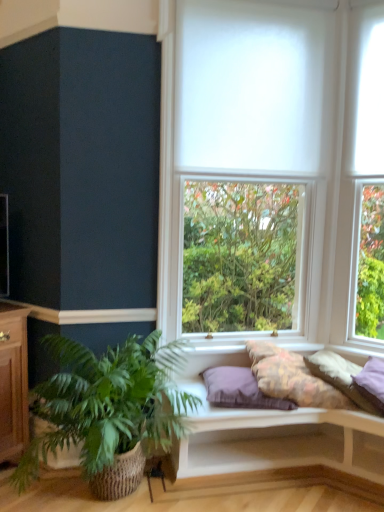
The image size is (384, 512). What do you see at coordinates (249, 87) in the screenshot? I see `white matte blind at upper center` at bounding box center [249, 87].

What do you see at coordinates (292, 378) in the screenshot? The height and width of the screenshot is (512, 384). I see `fluffy cotton pillow at center, the second pillow in the left-to-right sequence` at bounding box center [292, 378].

Based on the photo, measure the distance between point (207, 409) and camera.

Point (207, 409) is 7.18 feet from camera.

The image size is (384, 512). Find the location of `purple fabric pillow at center, which is the 1th pillow from left to right`. purple fabric pillow at center, which is the 1th pillow from left to right is located at coordinates (239, 390).

Measure the distance between point (x=35, y=391) and camera.

The distance of point (x=35, y=391) from camera is 2.07 meters.

This screenshot has height=512, width=384. In order to click on fluffy white pillow at right, which is the third pillow in left-to-right order in this screenshot , I will do `click(340, 377)`.

Does fluffy white pillow at right, marked as the 1th pillow in a right-to-left arrangement, have a greater height compared to white matte blind at upper center?

No, fluffy white pillow at right, marked as the 1th pillow in a right-to-left arrangement, is not taller than white matte blind at upper center.

Is fluffy white pillow at right, which is the third pillow in left-to-right order, located outside white matte blind at upper center?

Absolutely, fluffy white pillow at right, which is the third pillow in left-to-right order, is external to white matte blind at upper center.

Is fluffy white pillow at right, marked as the 1th pillow in a right-to-left arrangement, oriented towards white matte blind at upper center?

No.

Is purple fabric pillow at center, which is the 1th pillow from left to right, next to white matte window at center?

No, purple fabric pillow at center, which is the 1th pillow from left to right, is not touching white matte window at center.

From a real-world perspective, which is physically below, purple fabric pillow at center, which ranks as the 3th pillow in right-to-left order, or white matte window at center?

purple fabric pillow at center, which ranks as the 3th pillow in right-to-left order, is physically lower.

From the image's perspective, which one is positioned lower, purple fabric pillow at center, which is the 1th pillow from left to right, or white matte window at center?

purple fabric pillow at center, which is the 1th pillow from left to right, is shown below in the image.

Looking at this image, which is farther from the camera, (225, 404) or (332, 76)?

The point (332, 76) is behind.

Is green woven basket at lower left completely or partially inside fluffy white pillow at right, which is the third pillow in left-to-right order?

No, fluffy white pillow at right, which is the third pillow in left-to-right order, does not contain green woven basket at lower left.

Considering the relative sizes of fluffy white pillow at right, marked as the 1th pillow in a right-to-left arrangement, and green woven basket at lower left in the image provided, is fluffy white pillow at right, marked as the 1th pillow in a right-to-left arrangement, taller than green woven basket at lower left?

Incorrect, the height of fluffy white pillow at right, marked as the 1th pillow in a right-to-left arrangement, is not larger of that of green woven basket at lower left.

Considering the sizes of objects fluffy white pillow at right, marked as the 1th pillow in a right-to-left arrangement, and green woven basket at lower left in the image provided, who is bigger, fluffy white pillow at right, marked as the 1th pillow in a right-to-left arrangement, or green woven basket at lower left?

With larger size is green woven basket at lower left.

How different are the orientations of fluffy white pillow at right, marked as the 1th pillow in a right-to-left arrangement, and green woven basket at lower left in degrees?

The angular difference between fluffy white pillow at right, marked as the 1th pillow in a right-to-left arrangement, and green woven basket at lower left is 42.2 degrees.

Who is bigger, fluffy cotton pillow at center, which is the 2th pillow in right-to-left order, or white matte blind at upper center?

With larger size is fluffy cotton pillow at center, which is the 2th pillow in right-to-left order.

From the picture: Considering the positions of objects fluffy cotton pillow at center, the second pillow in the left-to-right sequence, and white matte blind at upper center in the image provided, who is more to the left, fluffy cotton pillow at center, the second pillow in the left-to-right sequence, or white matte blind at upper center?

Positioned to the left is white matte blind at upper center.

Does fluffy cotton pillow at center, the second pillow in the left-to-right sequence, touch white matte blind at upper center?

No, fluffy cotton pillow at center, the second pillow in the left-to-right sequence, is not touching white matte blind at upper center.

Is the depth of fluffy cotton pillow at center, the second pillow in the left-to-right sequence, greater than that of white matte blind at upper center?

No.

Is white matte window at center positioned beyond the bounds of green woven basket at lower left?

Yes, white matte window at center is outside of green woven basket at lower left.

The height and width of the screenshot is (512, 384). What are the coordinates of `houseplant in front of the white matte window at center` in the screenshot? It's located at (107, 411).

Does white matte window at center come in front of green woven basket at lower left?

No, white matte window at center is further to the viewer.

From a real-world perspective, between fluffy cotton pillow at center, the second pillow in the left-to-right sequence, and white matte window at center, who is vertically lower?

fluffy cotton pillow at center, the second pillow in the left-to-right sequence, is physically lower.

Based on the photo, which of these two, fluffy cotton pillow at center, the second pillow in the left-to-right sequence, or white matte window at center, is wider?

fluffy cotton pillow at center, the second pillow in the left-to-right sequence.

Does point (336, 397) lie in front of point (163, 52)?

Yes.

From the image's perspective, which is above, fluffy cotton pillow at center, the second pillow in the left-to-right sequence, or white matte window at center?

white matte window at center is shown above in the image.

Which object is further away from the camera taking this photo, white matte blind at upper center or green woven basket at lower left?

white matte blind at upper center is further from the camera.

Is white matte blind at upper center taller than green woven basket at lower left?

Indeed, white matte blind at upper center has a greater height compared to green woven basket at lower left.

Which point is more forward, (261, 99) or (131, 439)?

The point (131, 439) is more forward.

Is white matte blind at upper center looking in the opposite direction of green woven basket at lower left?

No, white matte blind at upper center's orientation is not away from green woven basket at lower left.

The width and height of the screenshot is (384, 512). What are the coordinates of `blind behind the fluffy white pillow at right, marked as the 1th pillow in a right-to-left arrangement` in the screenshot? It's located at (249, 87).

This screenshot has width=384, height=512. In order to click on pillow that is the 1st one when counting forward from the white matte window at center in this screenshot , I will do `click(239, 390)`.

From the image, which object appears to be nearer to white matte window at center, fluffy cotton pillow at center, the second pillow in the left-to-right sequence, or fluffy white pillow at right, marked as the 1th pillow in a right-to-left arrangement?

The object closer to white matte window at center is fluffy cotton pillow at center, the second pillow in the left-to-right sequence.

Estimate the real-world distances between objects in this image. Which object is further from white cushioned bench at lower center, purple fabric pillow at center, which ranks as the 3th pillow in right-to-left order, or fluffy cotton pillow at center, which is the 2th pillow in right-to-left order?

fluffy cotton pillow at center, which is the 2th pillow in right-to-left order, is further to white cushioned bench at lower center.

Considering their positions, is white matte window at center positioned closer to white cushioned bench at lower center than fluffy white pillow at right, marked as the 1th pillow in a right-to-left arrangement?

fluffy white pillow at right, marked as the 1th pillow in a right-to-left arrangement.

Based on their spatial positions, is fluffy white pillow at right, marked as the 1th pillow in a right-to-left arrangement, or white matte blind at upper center closer to white cushioned bench at lower center?

Based on the image, fluffy white pillow at right, marked as the 1th pillow in a right-to-left arrangement, appears to be nearer to white cushioned bench at lower center.

From the picture: Based on their spatial positions, is purple fabric pillow at center, which is the 1th pillow from left to right, or white matte window at center closer to white matte blind at upper center?

white matte window at center.

When comparing their distances from green woven basket at lower left, does white matte window at center or white cushioned bench at lower center seem closer?

white cushioned bench at lower center is positioned closer to the anchor green woven basket at lower left.

When comparing their distances from green woven basket at lower left, does white cushioned bench at lower center or fluffy white pillow at right, marked as the 1th pillow in a right-to-left arrangement, seem closer?

The object closer to green woven basket at lower left is white cushioned bench at lower center.

From the image, which object appears to be farther from white matte window at center, purple fabric pillow at center, which is the 1th pillow from left to right, or white matte blind at upper center?

Among the two, purple fabric pillow at center, which is the 1th pillow from left to right, is located further to white matte window at center.

Find the location of a particular element. window between white matte blind at upper center and white cushioned bench at lower center in the up-down direction is located at coordinates (276, 132).

The height and width of the screenshot is (512, 384). In order to click on pillow between white matte blind at upper center and fluffy white pillow at right, marked as the 1th pillow in a right-to-left arrangement, in the vertical direction in this screenshot , I will do `click(292, 378)`.

At what (x,y) coordinates should I click in order to perform the action: click on pillow between green woven basket at lower left and white cushioned bench at lower center from left to right. Please return your answer as a coordinate pair (x, y). Looking at the image, I should click on (239, 390).

Identify the location of pillow between white cushioned bench at lower center and fluffy cotton pillow at center, the second pillow in the left-to-right sequence, from front to back. (340, 377).